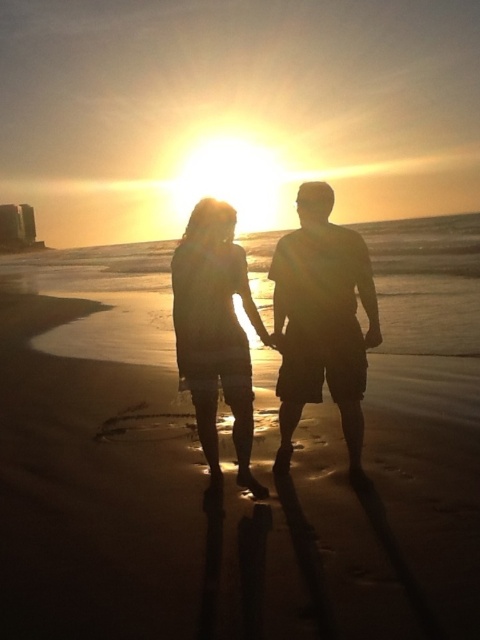
Question: Which is farther from the silhouette dress at center?

Choices:
 (A) silhouette shorts at center
 (B) sandy beach at center

Answer: (B)

Question: Where is sandy beach at center located in relation to silhouette shorts at center in the image?

Choices:
 (A) below
 (B) above

Answer: (B)

Question: Is sandy beach at center above silhouette shorts at center?

Choices:
 (A) no
 (B) yes

Answer: (B)

Question: Which of the following is the farthest from the observer?

Choices:
 (A) sandy beach at center
 (B) silhouette dress at center
 (C) silhouette shorts at center

Answer: (C)

Question: Is sandy beach at center to the right of silhouette dress at center from the viewer's perspective?

Choices:
 (A) yes
 (B) no

Answer: (A)

Question: Among these objects, which one is nearest to the camera?

Choices:
 (A) silhouette shorts at center
 (B) silhouette dress at center

Answer: (B)